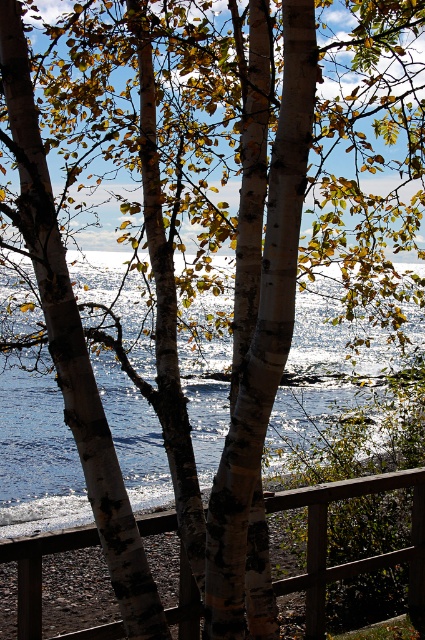
Question: Is glistening water at center to the left of wooden at center from the viewer's perspective?

Choices:
 (A) yes
 (B) no

Answer: (B)

Question: Can you confirm if glistening water at center is positioned below wooden at center?

Choices:
 (A) yes
 (B) no

Answer: (B)

Question: Which of the following is the closest to the observer?

Choices:
 (A) glistening water at center
 (B) wooden at center

Answer: (B)

Question: Which point is closer to the camera?

Choices:
 (A) glistening water at center
 (B) wooden at center

Answer: (B)

Question: From the image, what is the correct spatial relationship of glistening water at center in relation to wooden at center?

Choices:
 (A) above
 (B) below

Answer: (A)